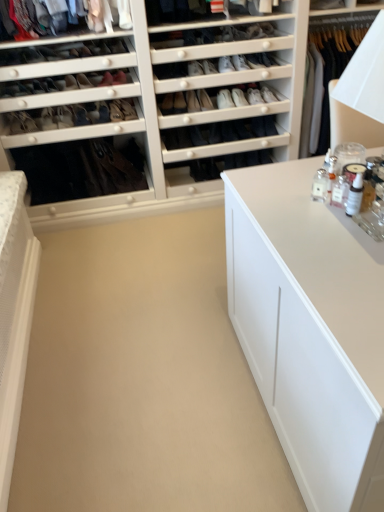
The image size is (384, 512). Describe the element at coordinates (80, 115) in the screenshot. I see `matte black shoe at center, which appears as the 7th shoe when viewed from the right` at that location.

Where is `matte black shoe at center, the 7th shoe from the left`? This screenshot has width=384, height=512. matte black shoe at center, the 7th shoe from the left is located at coordinates (209, 67).

This screenshot has height=512, width=384. Find the location of `matte black shoe at center, positioned as the 6th shoe in right-to-left order`. matte black shoe at center, positioned as the 6th shoe in right-to-left order is located at coordinates (116, 111).

What do you see at coordinates (142, 378) in the screenshot? The width and height of the screenshot is (384, 512). I see `white matte cabinet at center` at bounding box center [142, 378].

Image resolution: width=384 pixels, height=512 pixels. Describe the element at coordinates (195, 68) in the screenshot. I see `matte black shoe at center, the 4th shoe in the right-to-left sequence` at that location.

You are a GUI agent. You are given a task and a screenshot of the screen. Output one action in this format:
    pyautogui.click(x=<x>, y=<y>)
    Task: Click on the matte black shoe at center, positioned as the 5th shoe in left-to-right order
    
    Given the screenshot: What is the action you would take?
    point(128,109)

The height and width of the screenshot is (512, 384). I want to click on white leather shoe at upper center, which is counted as the 1th shoe, starting from the right, so click(268, 95).

There is a matte black shoe at center, the 7th shoe from the left. In order to click on the 7th shoe below it (from a real-world perspective) in this screenshot , I will do `click(128, 109)`.

Does matte black shoe at center, the 7th shoe from the left, touch matte black shoe at center, which is counted as the 5th shoe, starting from the right?

No, matte black shoe at center, the 7th shoe from the left, is not with matte black shoe at center, which is counted as the 5th shoe, starting from the right.

In the scene shown: Does matte black shoe at center, the 7th shoe from the left, turn towards matte black shoe at center, which is counted as the 5th shoe, starting from the right?

No, matte black shoe at center, the 7th shoe from the left, does not turn towards matte black shoe at center, which is counted as the 5th shoe, starting from the right.

From a real-world perspective, is matte black shoe at center, marked as the 3th shoe in a right-to-left arrangement, below matte black shoe at center, positioned as the 5th shoe in left-to-right order?

No.

Considering the sizes of objects matte black shoe at center, which is counted as the second shoe, starting from the left, and matte black shoe at center, which is counted as the 5th shoe, starting from the right, in the image provided, who is taller, matte black shoe at center, which is counted as the second shoe, starting from the left, or matte black shoe at center, which is counted as the 5th shoe, starting from the right,?

matte black shoe at center, which is counted as the second shoe, starting from the left, is taller.

Is matte black shoe at center, the 8th shoe viewed from the right, far away from matte black shoe at center, which is counted as the 5th shoe, starting from the right?

That's not correct — matte black shoe at center, the 8th shoe viewed from the right, is a little close to matte black shoe at center, which is counted as the 5th shoe, starting from the right.

Based on the photo, is matte black shoe at center, which is counted as the second shoe, starting from the left, smaller than matte black shoe at center, which is counted as the 5th shoe, starting from the right?

Actually, matte black shoe at center, which is counted as the second shoe, starting from the left, might be larger than matte black shoe at center, which is counted as the 5th shoe, starting from the right.

Considering the relative sizes of matte black shoe at center, the 8th shoe viewed from the right, and matte black shoe at center, which is counted as the 5th shoe, starting from the right, in the image provided, is matte black shoe at center, the 8th shoe viewed from the right, thinner than matte black shoe at center, which is counted as the 5th shoe, starting from the right,?

No.

Considering the relative sizes of matte black shoe at center, the 8th shoe viewed from the right, and matte black shoe at center, which ranks as the third shoe in left-to-right order, in the image provided, is matte black shoe at center, the 8th shoe viewed from the right, bigger than matte black shoe at center, which ranks as the third shoe in left-to-right order,?

No.

Which object is further away from the camera, matte black shoe at center, the 8th shoe viewed from the right, or matte black shoe at center, which ranks as the third shoe in left-to-right order?

matte black shoe at center, the 8th shoe viewed from the right, is behind.

From a real-world perspective, which object rests below the other?

From a 3D spatial view, matte black shoe at center, which is counted as the second shoe, starting from the left, is below.

Based on the photo, considering the positions of objects matte black shoe at center, which is counted as the second shoe, starting from the left, and matte black shoe at center, which appears as the 7th shoe when viewed from the right, in the image provided, who is more to the left, matte black shoe at center, which is counted as the second shoe, starting from the left, or matte black shoe at center, which appears as the 7th shoe when viewed from the right,?

From the viewer's perspective, matte black shoe at center, which is counted as the second shoe, starting from the left, appears more on the left side.

Is matte black shoe at center-left, which is the 9th shoe from right to left, not within clear glass bottles at upper right?

Absolutely, matte black shoe at center-left, which is the 9th shoe from right to left, is external to clear glass bottles at upper right.

Between point (45, 120) and point (317, 37), which one is positioned behind?

The point (317, 37) is farther.

Relative to clear glass bottles at upper right, is matte black shoe at center-left, which is the 9th shoe from right to left, in front or behind?

In the image, matte black shoe at center-left, which is the 9th shoe from right to left, appears behind clear glass bottles at upper right.

From a real-world perspective, is matte black shoe at center-left, the first shoe in the left-to-right sequence, physically located above or below clear glass bottles at upper right?

matte black shoe at center-left, the first shoe in the left-to-right sequence, is situated lower than clear glass bottles at upper right in the real world.

Looking at this image, from the image's perspective, which one is positioned lower, matte black shoe at center, which appears as the fourth shoe when viewed from the left, or matte black shoe at center-left, the first shoe in the left-to-right sequence?

matte black shoe at center-left, the first shoe in the left-to-right sequence, from the image's perspective.

Is matte black shoe at center, positioned as the 6th shoe in right-to-left order, surrounding matte black shoe at center-left, the first shoe in the left-to-right sequence?

No, matte black shoe at center-left, the first shoe in the left-to-right sequence, is not a part of matte black shoe at center, positioned as the 6th shoe in right-to-left order.

In the scene shown: Is matte black shoe at center, positioned as the 6th shoe in right-to-left order, oriented away from matte black shoe at center-left, which is the 9th shoe from right to left?

No, matte black shoe at center, positioned as the 6th shoe in right-to-left order, is not facing the opposite direction of matte black shoe at center-left, which is the 9th shoe from right to left.

Is there a large distance between matte black shoe at center, which appears as the fourth shoe when viewed from the left, and matte black shoe at center-left, which is the 9th shoe from right to left?

They are positioned close to each other.

Does matte black shoe at center, which ranks as the third shoe in left-to-right order, appear on the left side of matte black shoe at center, the 7th shoe from the left?

Indeed, matte black shoe at center, which ranks as the third shoe in left-to-right order, is positioned on the left side of matte black shoe at center, the 7th shoe from the left.

In order to click on the 5th shoe positioned above the matte black shoe at center, which ranks as the third shoe in left-to-right order (from the image's perspective) in this screenshot , I will do `click(209, 67)`.

Based on the photo, in terms of height, does matte black shoe at center, which appears as the 7th shoe when viewed from the right, look taller or shorter compared to matte black shoe at center, the 7th shoe from the left?

matte black shoe at center, which appears as the 7th shoe when viewed from the right, is taller than matte black shoe at center, the 7th shoe from the left.

Is clear glass bottles at upper right wider than matte black shoe at center, marked as the 3th shoe in a right-to-left arrangement?

Yes.

From the image's perspective, which one is positioned higher, clear glass bottles at upper right or matte black shoe at center, the 7th shoe from the left?

From the image's view, matte black shoe at center, the 7th shoe from the left, is above.

Considering the positions of points (302, 137) and (205, 62), is point (302, 137) closer to camera compared to point (205, 62)?

No.

Find the location of `the 7th shoe located beneath the matte black shoe at center, marked as the 3th shoe in a right-to-left arrangement (from a real-world perspective)`. the 7th shoe located beneath the matte black shoe at center, marked as the 3th shoe in a right-to-left arrangement (from a real-world perspective) is located at coordinates (128, 109).

From the matte black shoe at center, the 8th shoe viewed from the right, count 2nd shoes backward and point to it. Please provide its 2D coordinates.

[(128, 109)]

Considering their positions, is matte black shoe at center, which appears as the 7th shoe when viewed from the right, positioned closer to matte black shoe at center, the 8th shoe viewed from the right, than white matte cabinet at center?

The object closer to matte black shoe at center, the 8th shoe viewed from the right, is matte black shoe at center, which appears as the 7th shoe when viewed from the right.

Based on their spatial positions, is matte black shoe at center, the 7th shoe from the left, or clear glass bottles at upper right closer to matte black shoe at center-left, the first shoe in the left-to-right sequence?

The object closer to matte black shoe at center-left, the first shoe in the left-to-right sequence, is matte black shoe at center, the 7th shoe from the left.

From the image, which object appears to be nearer to matte black shoe at center, which appears as the fourth shoe when viewed from the left, matte black shoe at center, the 4th shoe in the right-to-left sequence, or matte black shoe at center, which ranks as the third shoe in left-to-right order?

matte black shoe at center, which ranks as the third shoe in left-to-right order, lies closer to matte black shoe at center, which appears as the fourth shoe when viewed from the left, than the other object.

From the image, which object appears to be nearer to matte black shoe at center, the 7th shoe from the left, matte black shoe at center, which appears as the fourth shoe when viewed from the left, or clear glass bottles at upper right?

matte black shoe at center, which appears as the fourth shoe when viewed from the left, lies closer to matte black shoe at center, the 7th shoe from the left, than the other object.

Looking at the image, which one is located closer to matte black shoe at center, which is counted as the second shoe, starting from the left, white leather shoe at upper center, the eighth shoe in the left-to-right sequence, or white matte cabinet at center?

white leather shoe at upper center, the eighth shoe in the left-to-right sequence, lies closer to matte black shoe at center, which is counted as the second shoe, starting from the left, than the other object.

From the image, which object appears to be nearer to matte black shoe at center, marked as the 3th shoe in a right-to-left arrangement, white leather shoe at upper center, the ninth shoe from the left, or matte black shoe at center-left, the first shoe in the left-to-right sequence?

white leather shoe at upper center, the ninth shoe from the left.

Looking at the image, which one is located closer to matte black shoe at center, which is the 6th shoe from left to right, matte black shoe at center, marked as the 3th shoe in a right-to-left arrangement, or matte black shoe at center, which appears as the fourth shoe when viewed from the left?

The object closer to matte black shoe at center, which is the 6th shoe from left to right, is matte black shoe at center, marked as the 3th shoe in a right-to-left arrangement.

Based on their spatial positions, is matte black shoe at center, positioned as the 5th shoe in left-to-right order, or matte black shoe at center, the 4th shoe in the right-to-left sequence, further from white leather shoe at upper center, which is counted as the 1th shoe, starting from the right?

matte black shoe at center, positioned as the 5th shoe in left-to-right order, is further to white leather shoe at upper center, which is counted as the 1th shoe, starting from the right.

Find the location of a particular element. The image size is (384, 512). plain between clear glass bottles at upper right and matte black shoe at center, the 7th shoe from the left, from front to back is located at coordinates (142, 378).

The image size is (384, 512). What are the coordinates of `shoe between matte black shoe at center, which appears as the fourth shoe when viewed from the left, and matte black shoe at center, which is the 6th shoe from left to right` in the screenshot? It's located at (128, 109).

Image resolution: width=384 pixels, height=512 pixels. What are the coordinates of `plain between clear glass bottles at upper right and matte black shoe at center, which is counted as the 5th shoe, starting from the right, along the z-axis` in the screenshot? It's located at (142, 378).

The image size is (384, 512). I want to click on plain between clear glass bottles at upper right and matte black shoe at center, which appears as the 7th shoe when viewed from the right, from front to back, so click(x=142, y=378).